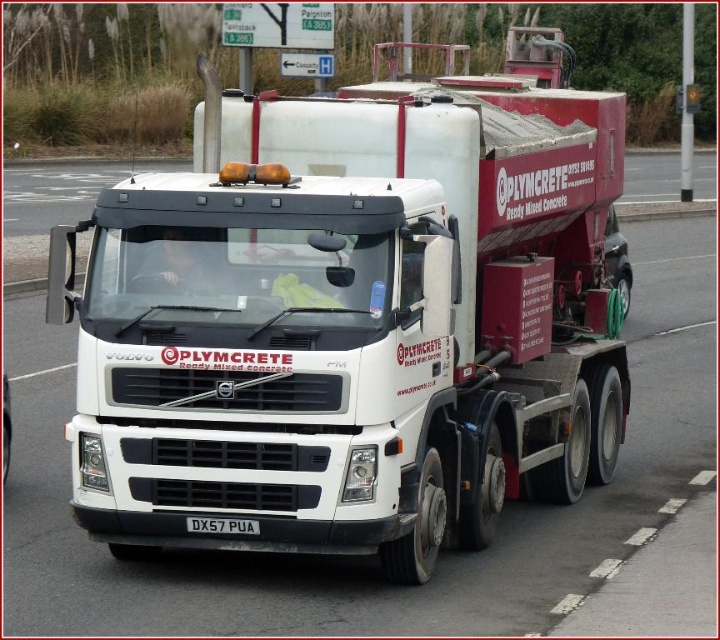
Question: Does white matte concrete mixer at center have a smaller size compared to white plastic license plate at center?

Choices:
 (A) yes
 (B) no

Answer: (B)

Question: Which object appears farthest from the camera in this image?

Choices:
 (A) white plastic license plate at center
 (B) white matte concrete mixer at center

Answer: (B)

Question: Does white matte concrete mixer at center have a lesser width compared to white plastic license plate at center?

Choices:
 (A) no
 (B) yes

Answer: (B)

Question: Does white matte concrete mixer at center come behind white plastic license plate at center?

Choices:
 (A) no
 (B) yes

Answer: (B)

Question: Which of the following is the farthest from the observer?

Choices:
 (A) (192, 524)
 (B) (225, 100)

Answer: (B)

Question: Which of the following is the farthest from the observer?

Choices:
 (A) (233, 458)
 (B) (222, 520)

Answer: (B)